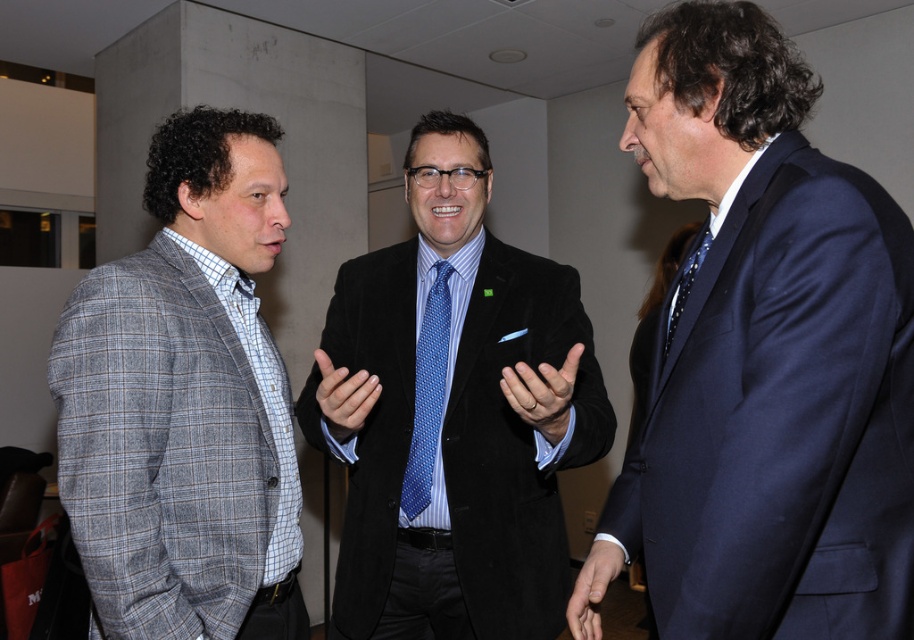
You are a photographer positioned at the entrance of the room. You want to take a photo of both the gray plaid blazer at left and the velvet black suit at center without any obstruction. Which person should you move slightly forward so that the other is visible?

The gray plaid blazer at left is behind the velvet black suit at center. To ensure both are visible without obstruction, you should move the velvet black suit at center slightly forward so that the gray plaid blazer at left is no longer blocked.

In the image, there are three men in an office setting. The man on the left is wearing a gray plaid blazer and light blue and white checkered shirt. The central figure is wearing glasses and a dark suit with a light blue tie and a small green pin on his lapel. There is also a point labeled at coordinates (453, 413). What object does this point correspond to?

The point at coordinates (453, 413) corresponds to the velvet black suit at center.

You are an event planner arranging seating for a formal dinner. You need to seat guests according to their attire colors. The navy blue suit at right and velvet black suit at center are both present. Which guest should be seated to the left of the other based on their clothing color?

The navy blue suit at right is positioned over velvet black suit at center, so the velvet black suit at center should be seated to the left of the navy blue suit at right.